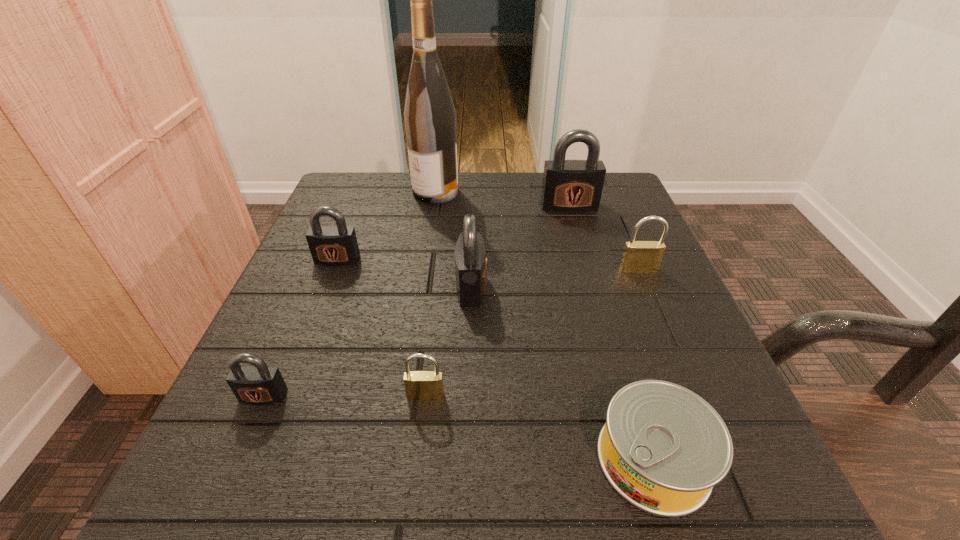
Where is `free space that satisfies the following two spatial constraints: 1. on the front of the can near the keyhole; 2. on the left side of the farthest padlock`? free space that satisfies the following two spatial constraints: 1. on the front of the can near the keyhole; 2. on the left side of the farthest padlock is located at coordinates (641, 459).

Where is `vacant space that satisfies the following two spatial constraints: 1. on the front of the silver can near the keyhole; 2. on the left side of the sixth shortest object`? The height and width of the screenshot is (540, 960). vacant space that satisfies the following two spatial constraints: 1. on the front of the silver can near the keyhole; 2. on the left side of the sixth shortest object is located at coordinates (x=468, y=459).

Locate an element on the screen. The image size is (960, 540). free space that satisfies the following two spatial constraints: 1. on the front-facing side of the smaller brass padlock; 2. on the left side of the silver can is located at coordinates (419, 459).